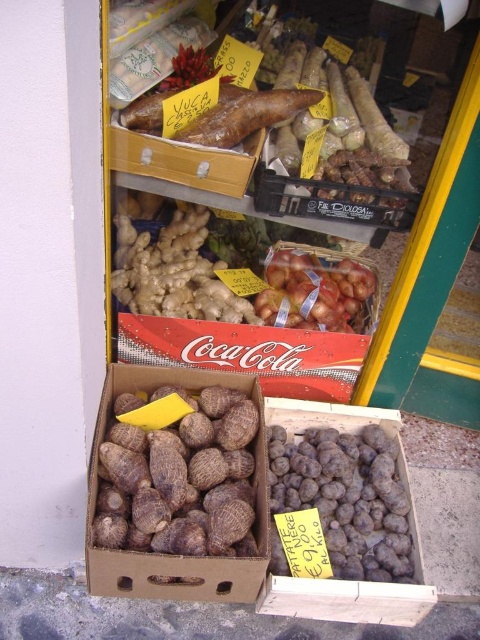
You are a customer at the market and want to buy both the brown rough taro at lower center and the shiny brown onions at center. However, your shopping bag can only hold items that are narrower than 30 cm. Can you determine if both items will fit based on their widths?

The brown rough taro at lower center might be wider than shiny brown onions at center. Since the taro might exceed 30 cm in width, it might not fit in the bag. The onions are narrower, so they should fit. However, without exact measurements, it is uncertain if the taro will fit.

You are a customer at the market stall looking for the cheapest taro. You see two taro locations labeled as brown rough taro at center and brown rough taro at lower center. Which taro is closer to you?

The brown rough taro at center is closer to you because it is in front of the brown rough taro at lower center.

You are a customer at the market stall looking at the brown rough taro at center and the shiny brown onions at center. Which of these two items is positioned closer to you?

The brown rough taro at center is closer to the viewer than the shiny brown onions at center.